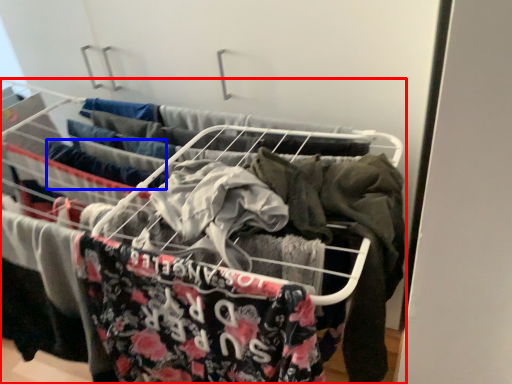
Question: Among these objects, which one is nearest to the camera, furniture (highlighted by a red box) or clothing (highlighted by a blue box)?

Choices:
 (A) furniture
 (B) clothing

Answer: (A)